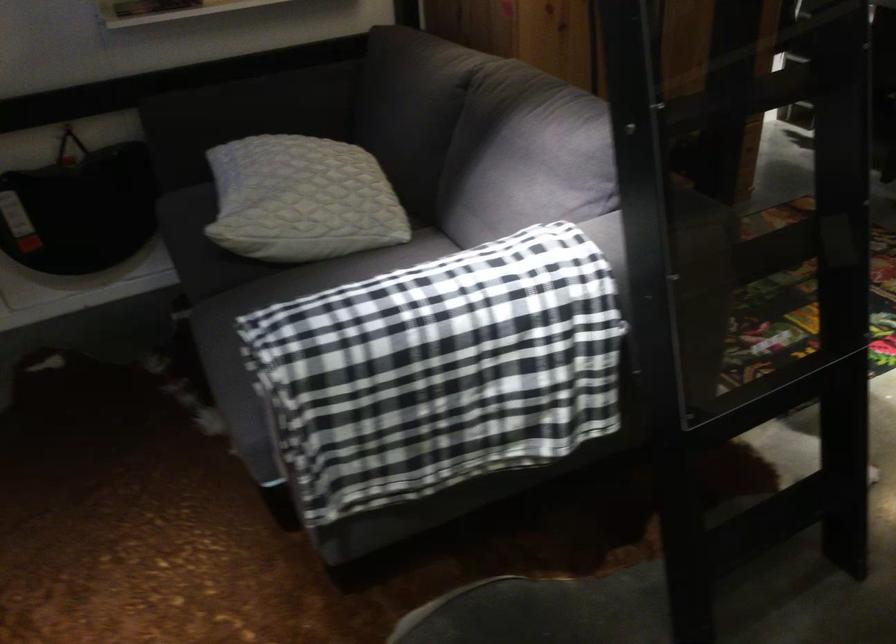
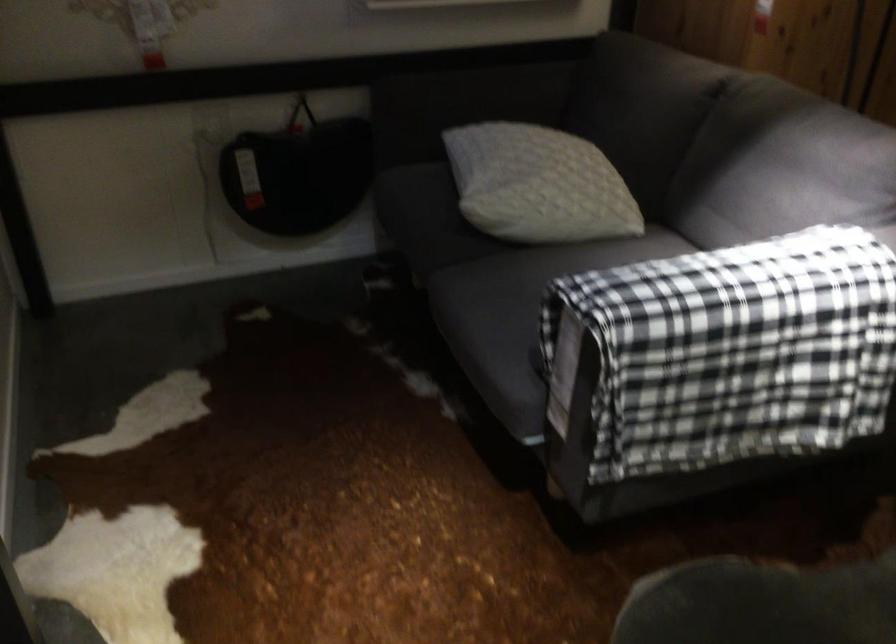
The point at (x=296, y=204) is marked in the first image. Where is the corresponding point in the second image?

(538, 185)